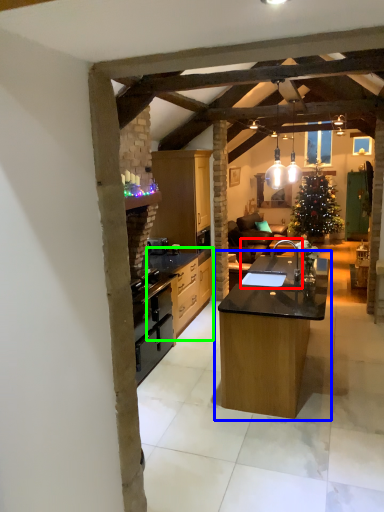
Question: Which is farther away from sink (highlighted by a red box)? table (highlighted by a blue box) or cabinetry (highlighted by a green box)?

Choices:
 (A) table
 (B) cabinetry

Answer: (B)